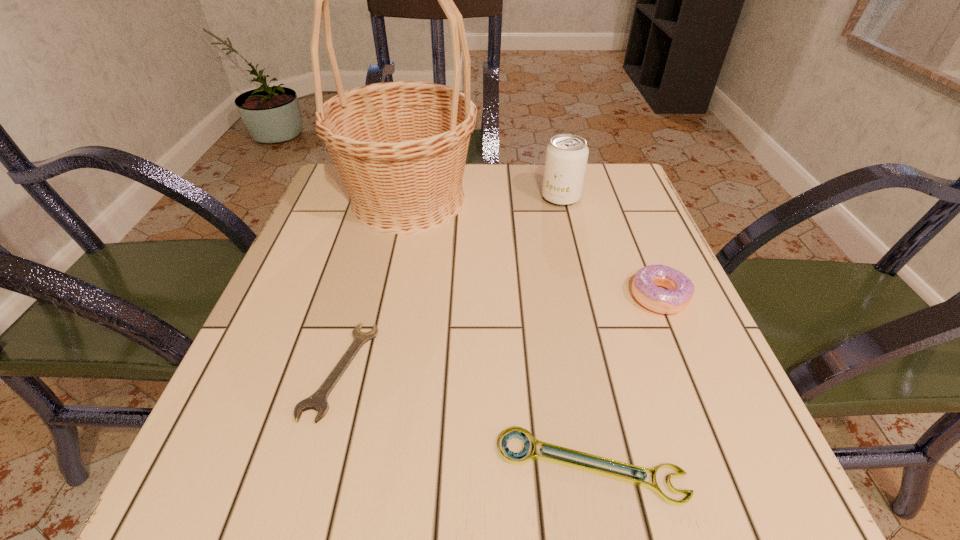
Select which object appears as the closest to the left wrench. Please provide its 2D coordinates. Your answer should be formatted as a tuple, i.e. [(x, y)], where the tuple contains the x and y coordinates of a point satisfying the conditions above.

[(513, 432)]

Identify the location of vacant space that satisfies the following two spatial constraints: 1. on the back side of the third tallest object; 2. on the right side of the right wrench. Image resolution: width=960 pixels, height=540 pixels. (559, 296).

Locate an element on the screen. blank area in the image that satisfies the following two spatial constraints: 1. on the front side of the basket; 2. on the right side of the third farthest object is located at coordinates (388, 296).

Identify the location of free space that satisfies the following two spatial constraints: 1. on the front side of the basket; 2. on the left side of the nearer wrench. This screenshot has width=960, height=540. coord(351,466).